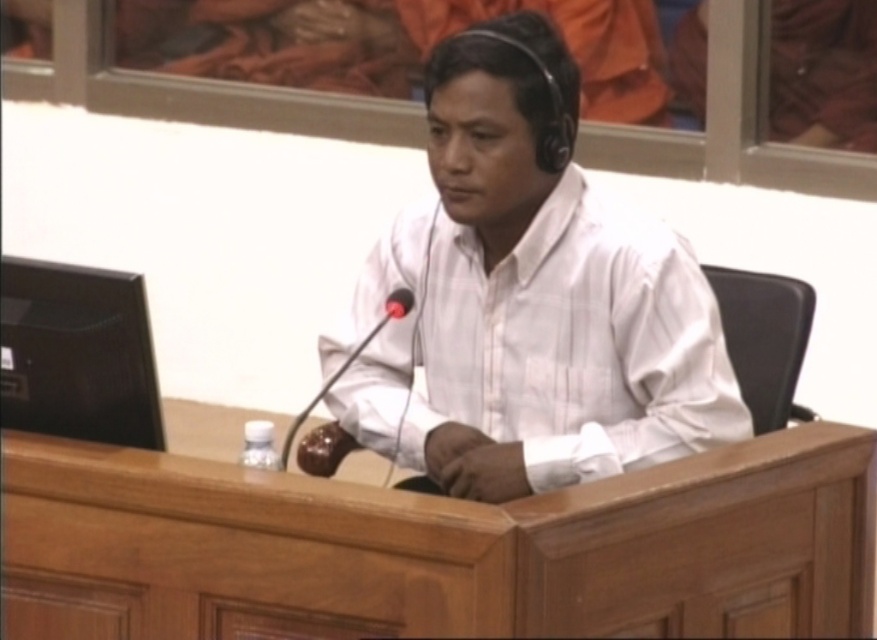
Question: Which of the following is the closest to the observer?

Choices:
 (A) (364, 339)
 (B) (669, 486)

Answer: (B)

Question: Does white matte shirt at center have a lesser width compared to brown leather microphone at center?

Choices:
 (A) yes
 (B) no

Answer: (B)

Question: Which object is farther from the camera taking this photo?

Choices:
 (A) brown leather microphone at center
 (B) white matte shirt at center
 (C) wooden table at center

Answer: (B)

Question: Which point is farther to the camera?

Choices:
 (A) (286, 452)
 (B) (72, 582)

Answer: (A)

Question: Is the position of wooden table at center less distant than that of white matte shirt at center?

Choices:
 (A) yes
 (B) no

Answer: (A)

Question: Does white matte shirt at center come behind brown leather microphone at center?

Choices:
 (A) yes
 (B) no

Answer: (A)